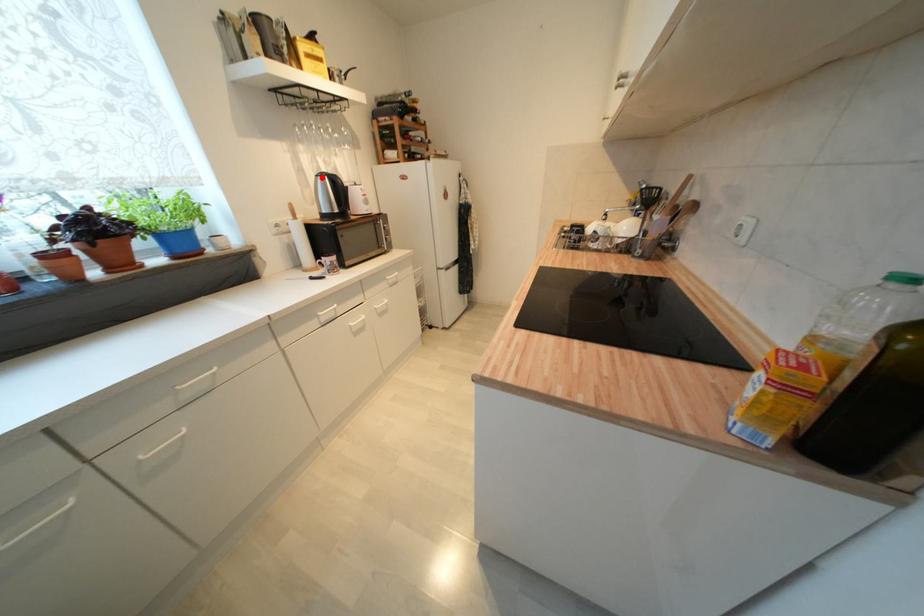
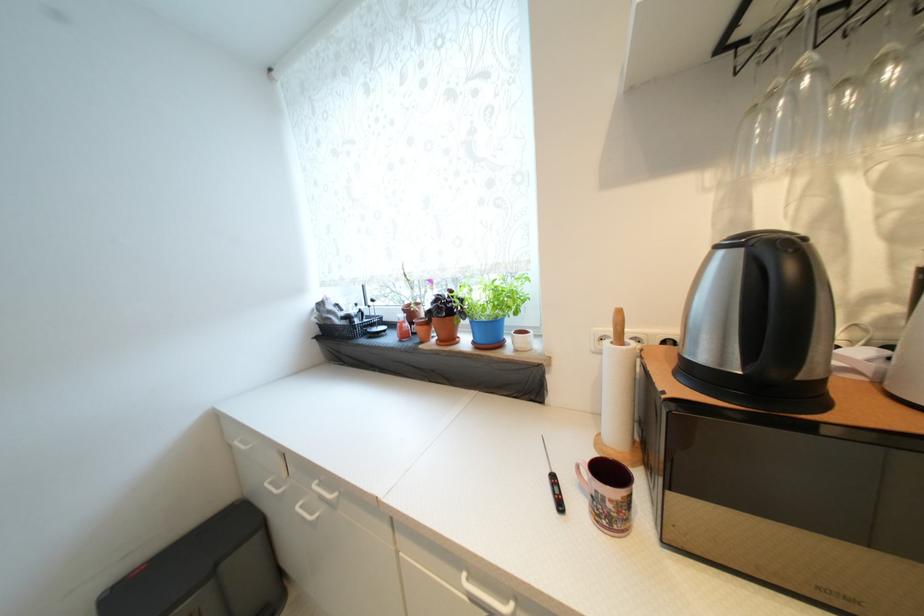
Question: I am providing you with two images of the same scene from different viewpoints. A red point is marked on the first image. At the location where the point appears in image 1, is it still visible in image 2?

Choices:
 (A) Yes
 (B) No

Answer: (A)